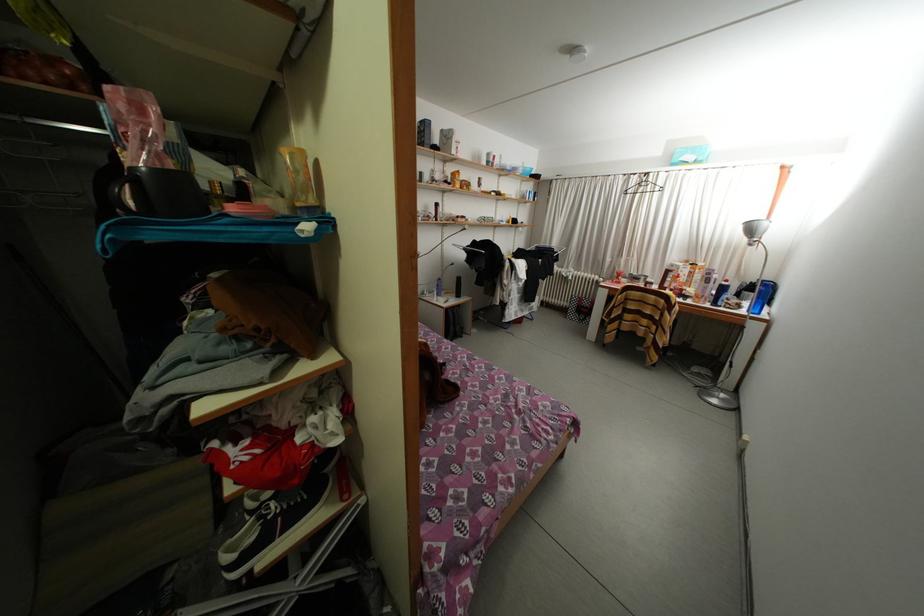
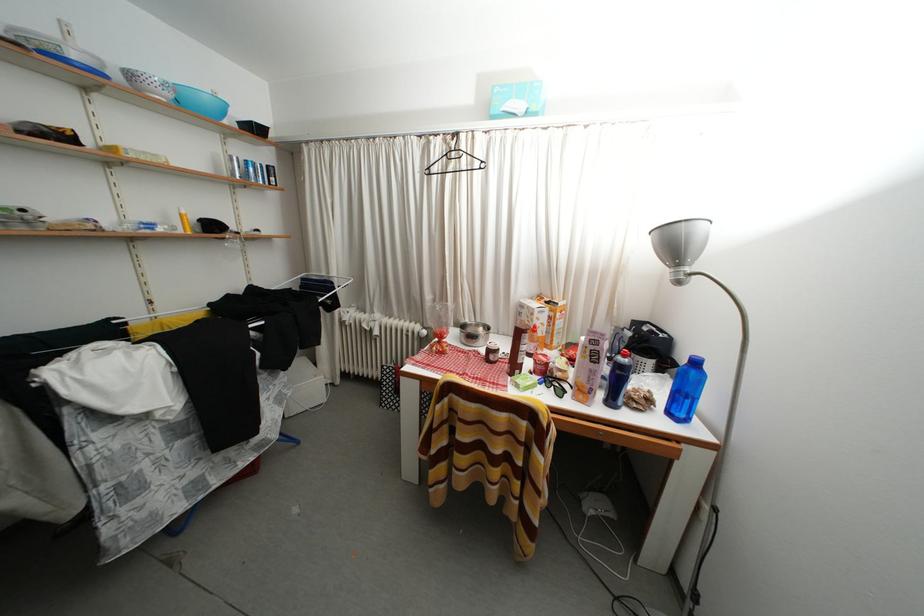
In the second image, find the point that corresponds to (723,309) in the first image.

(618, 408)